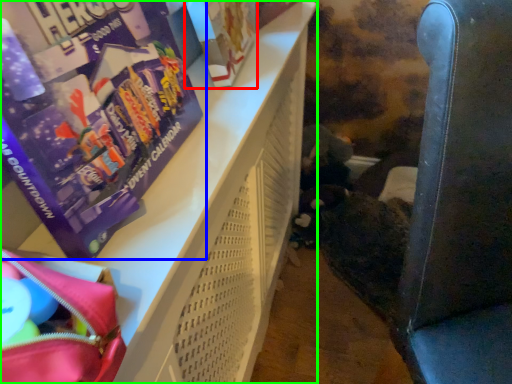
Question: Based on their relative distances, which object is nearer to paperback book (highlighted by a red box)? Choose from book (highlighted by a blue box) and furniture (highlighted by a green box).

Choices:
 (A) book
 (B) furniture

Answer: (B)